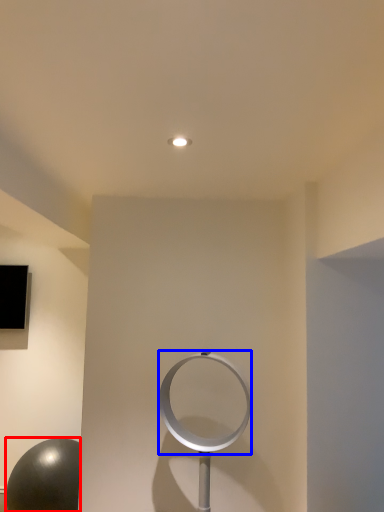
Question: Which object appears farthest to the camera in this image, ball (highlighted by a red box) or circle (highlighted by a blue box)?

Choices:
 (A) ball
 (B) circle

Answer: (A)